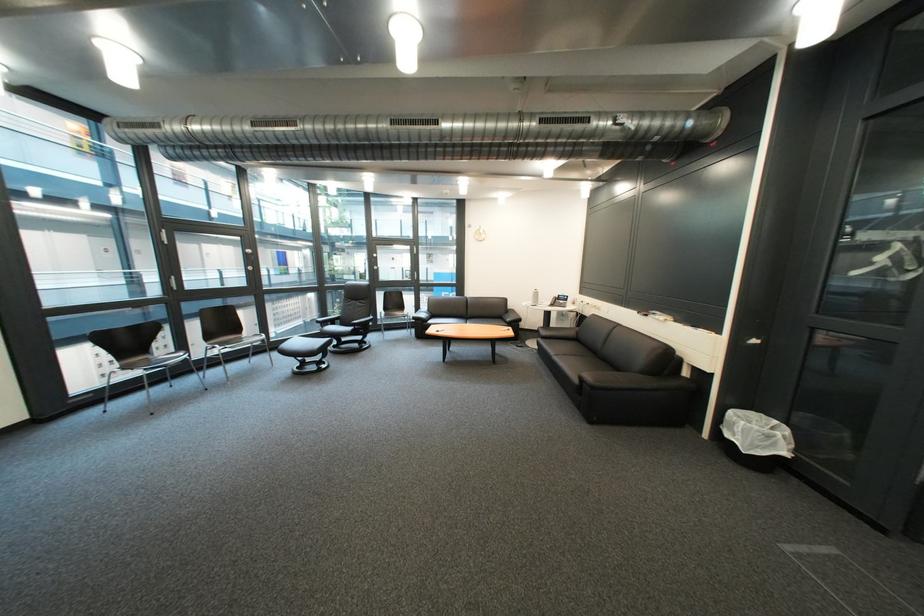
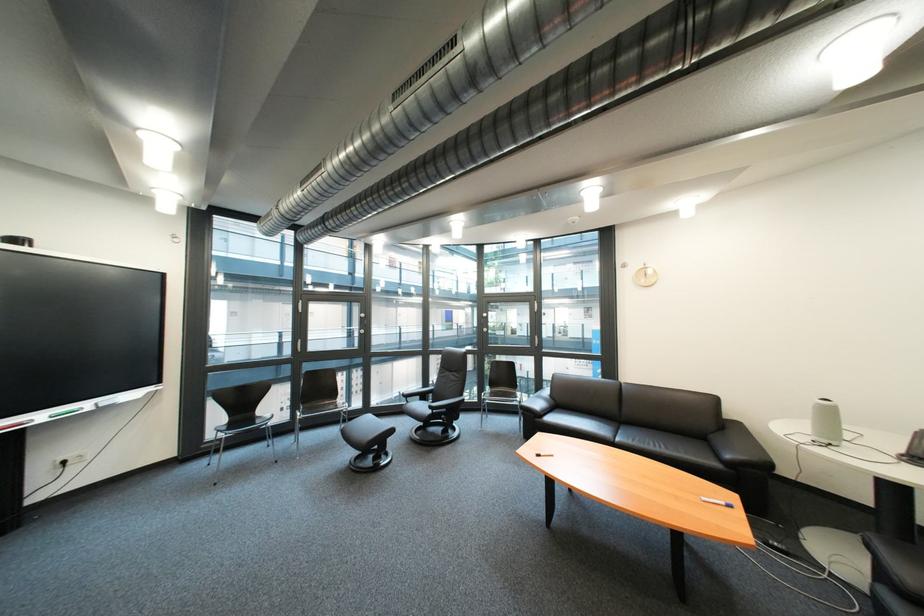
The point at (x=229, y=347) is marked in the first image. Where is the corresponding point in the second image?

(312, 415)